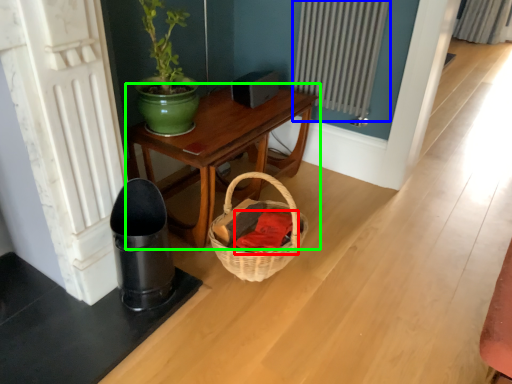
Question: Which is nearer to the clothing (highlighted by a red box)? radiator (highlighted by a blue box) or table (highlighted by a green box).

Choices:
 (A) radiator
 (B) table

Answer: (B)